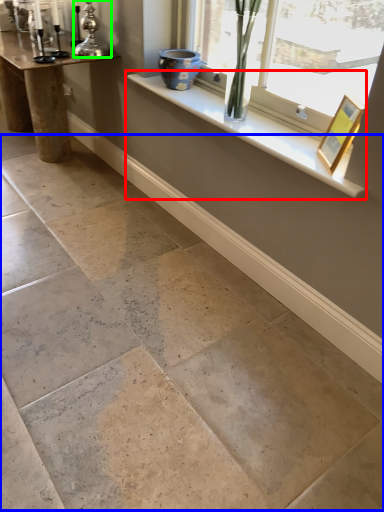
Question: Based on their relative distances, which object is nearer to window sill (highlighted by a red box)? Choose from concrete (highlighted by a blue box) and candle holder (highlighted by a green box).

Choices:
 (A) concrete
 (B) candle holder

Answer: (B)